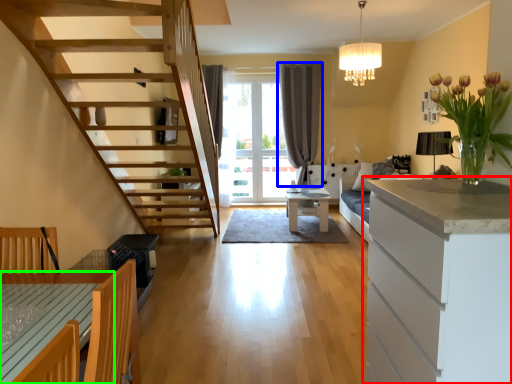
Question: Considering the real-world distances, which object is farthest from cabinetry (highlighted by a red box)? curtain (highlighted by a blue box) or table (highlighted by a green box)?

Choices:
 (A) curtain
 (B) table

Answer: (A)